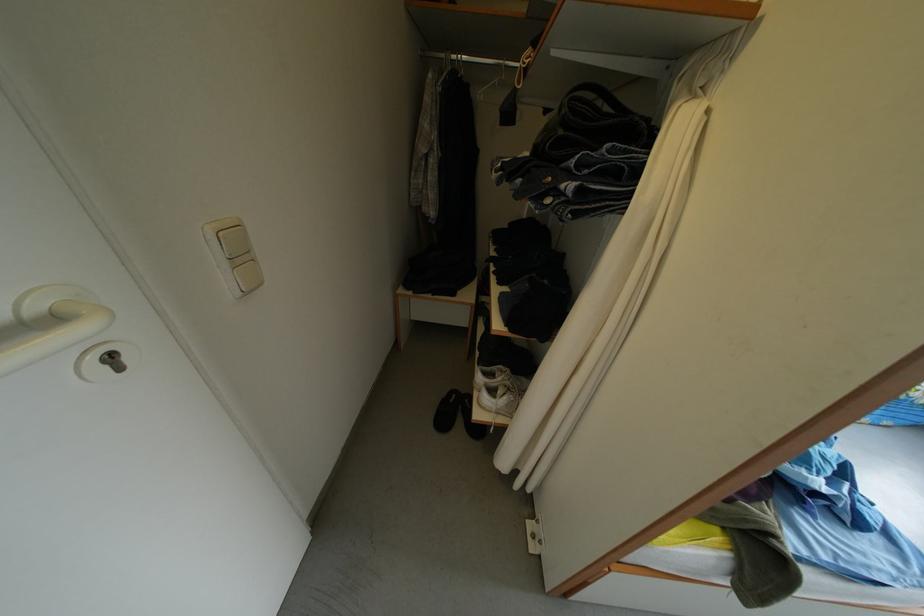
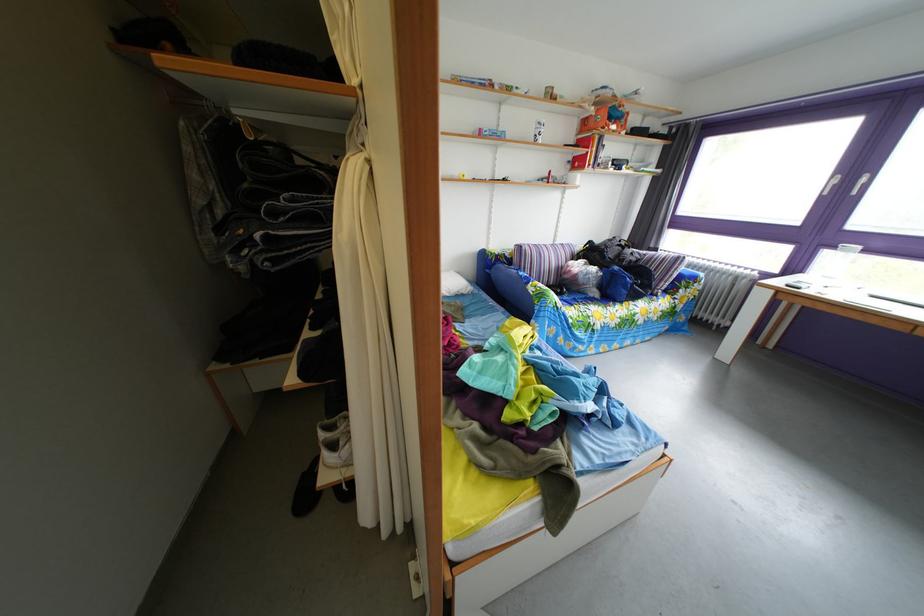
Question: The images are taken continuously from a first-person perspective. In which direction are you moving?

Choices:
 (A) Left
 (B) Right
 (C) Forward
 (D) Backward

Answer: (B)